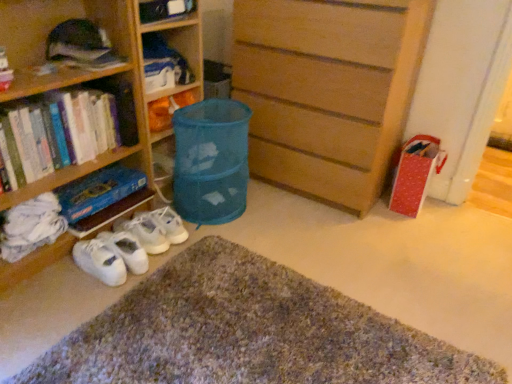
Question: Choose the correct answer: Is blue fabric laundry basket at center inside white cloth at lower left, the first book when ordered from bottom to top, or outside it?

Choices:
 (A) outside
 (B) inside

Answer: (A)

Question: Based on their positions, is blue fabric laundry basket at center located to the left or right of white cloth at lower left, which is the fourth book in top-to-bottom order?

Choices:
 (A) left
 (B) right

Answer: (B)

Question: Which of these objects is positioned closest to the matte plastic bag at center, which ranks as the 1th book in top-to-bottom order?

Choices:
 (A) wooden chest of drawers at center
 (B) white fabric sneakers at lower left
 (C) hardcover books at left, arranged as the 2th book when viewed from the top
 (D) hardcover book at lower left, marked as the third book in a top-to-bottom arrangement
 (E) white cloth at lower left, which is the fourth book in top-to-bottom order

Answer: (D)

Question: Estimate the real-world distances between objects in this image. Which object is closer to the textured woolen doormat at lower center?

Choices:
 (A) white fabric sneakers at lower left
 (B) wooden chest of drawers at center
 (C) white cloth at lower left, the first book when ordered from bottom to top
 (D) blue fabric laundry basket at center
 (E) matte plastic bag at center, the 4th book ordered from the bottom

Answer: (A)